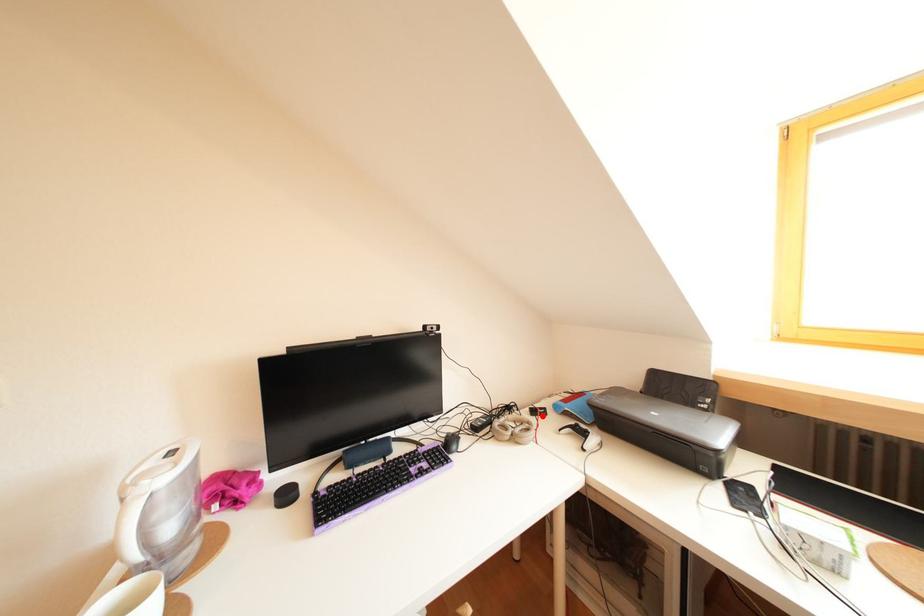
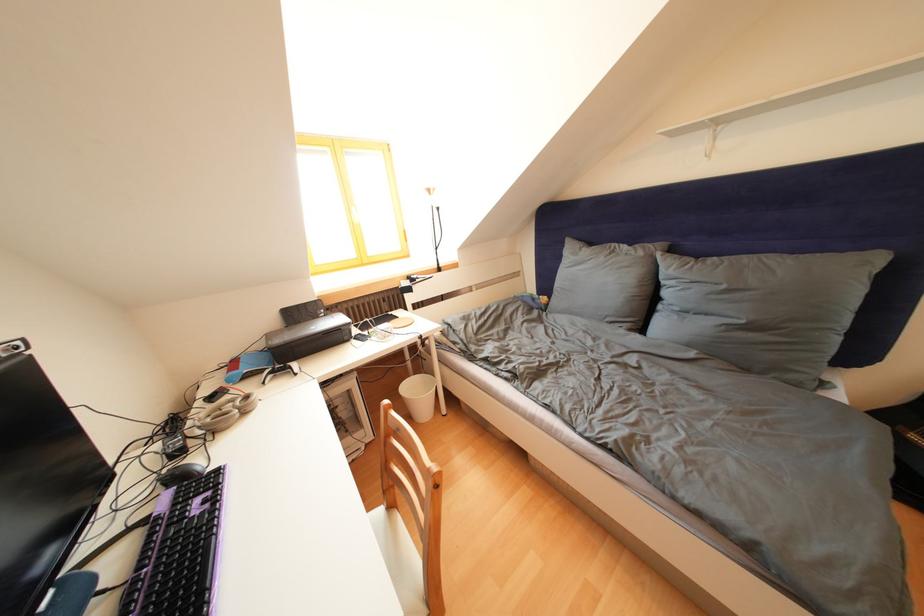
Locate, in the second image, the point that corresponds to the highlighted location in the first image.

(220, 403)